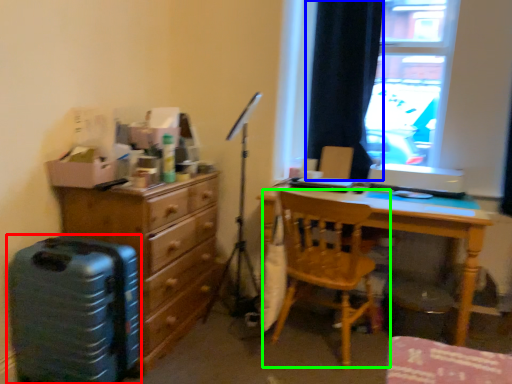
Question: Based on their relative distances, which object is farther from luggage (highlighted by a red box)? Choose from curtain (highlighted by a blue box) and chair (highlighted by a green box).

Choices:
 (A) curtain
 (B) chair

Answer: (A)